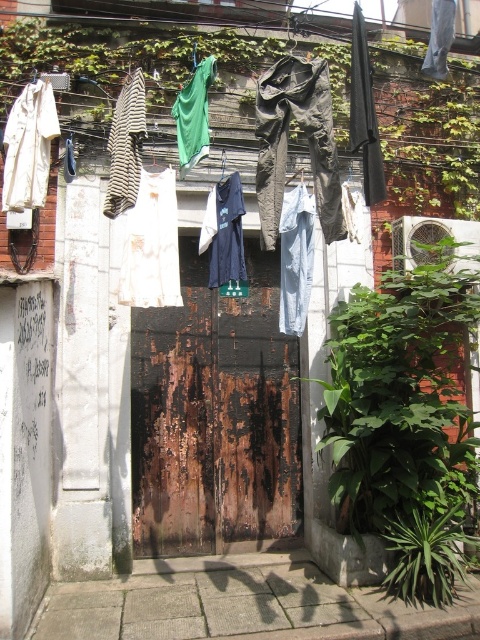
You are standing in front of the weathered wooden door and want to touch both the point at coordinates point [228,346] and the point at coordinates point [49,90]. Which point will you reach first?

You will reach the point at coordinates point [49,90] first because it is closer to you than the point at coordinates point [228,346], which is further away.

You are standing in front of a building and want to take a photo of the rusty wood door at center. If your camera has a maximum focus range of 5 meters, will you need to move closer to capture a clear image?

The rusty wood door at center is 5.82 meters away from the camera, which exceeds the camera maximum focus range of 5 meters. You need to move closer to capture a clear image.